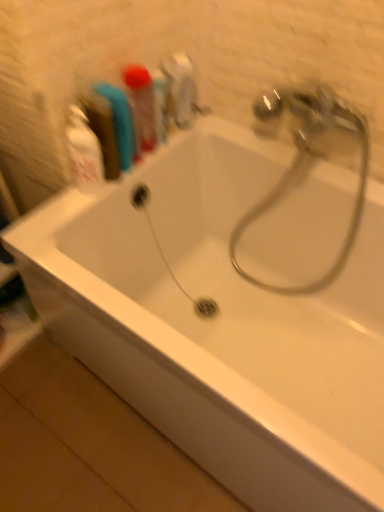
In order to click on free space in front of white glossy bottle at upper left in this screenshot , I will do `click(58, 228)`.